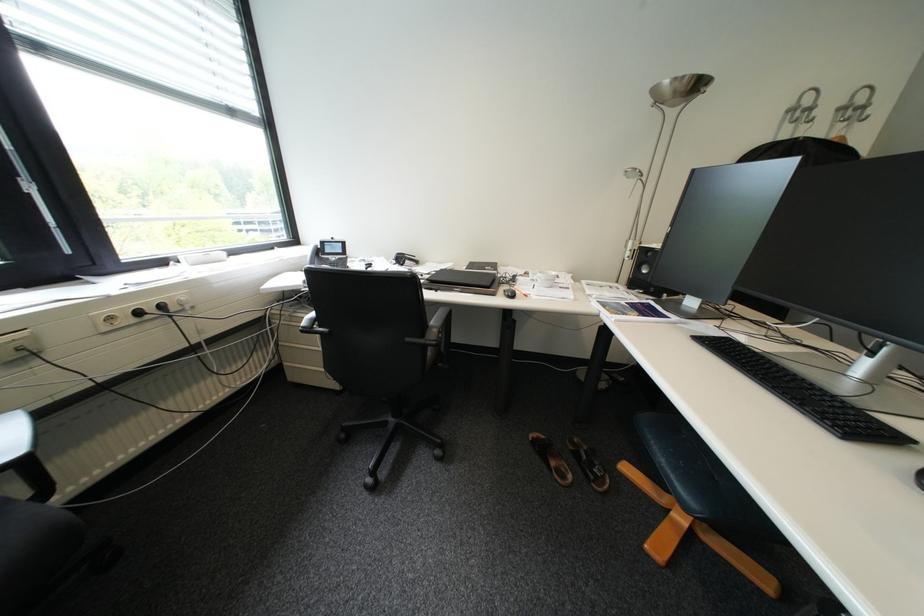
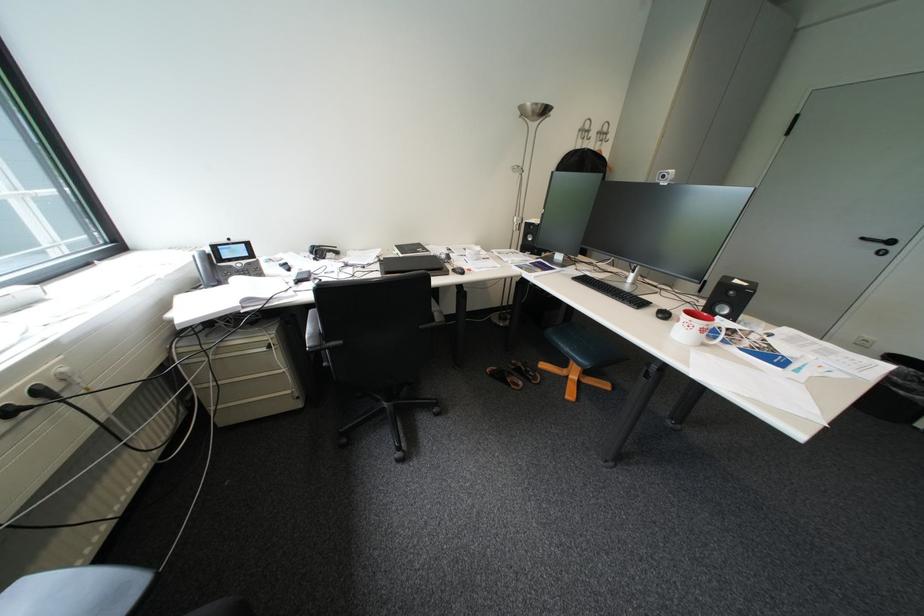
Locate, in the second image, the point that corresponds to the point at 544,438 in the first image.

(502, 371)